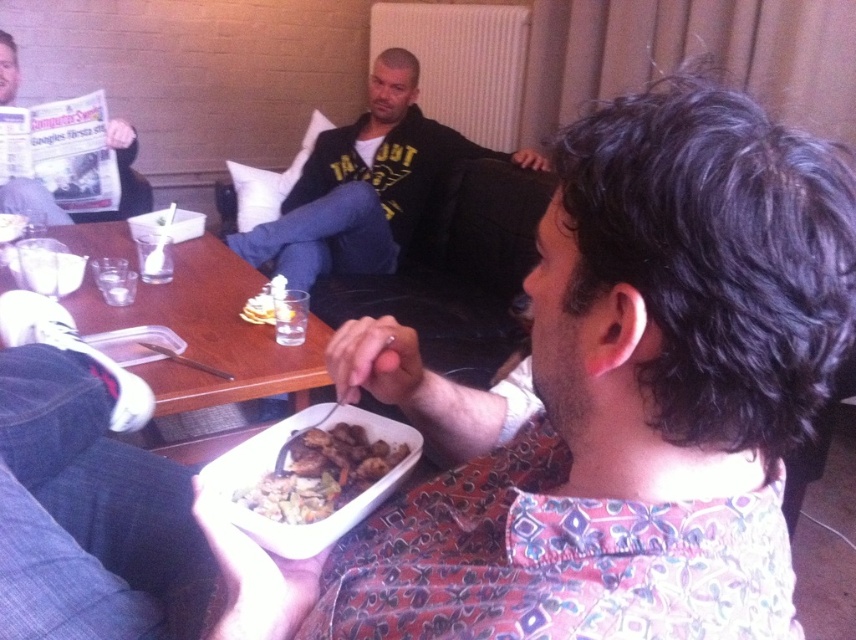
What is located at the point marked by the coordinates (364,186) in the image?

The point marked by the coordinates (364,186) corresponds to the location of the dark blue jeans at center.

Based on the coordinates provided, can you identify which object corresponds to the point at (364,186)?

The point at (364,186) corresponds to the dark blue jeans at center.